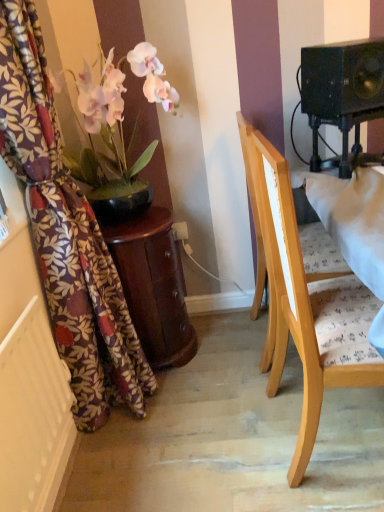
This screenshot has width=384, height=512. I want to click on free space in front of floral fabric curtain at left, so click(x=157, y=472).